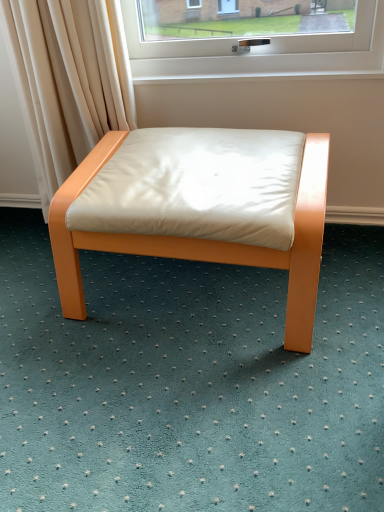
Find the location of a particular element. The width and height of the screenshot is (384, 512). free location to the left of white leather stool at center is located at coordinates (41, 300).